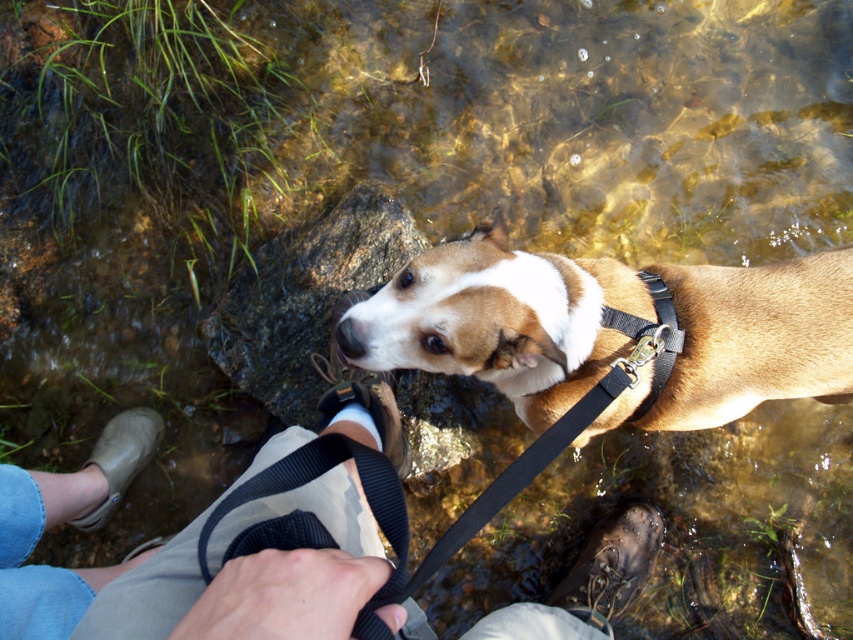
Looking at this image, you are standing behind the brown matte dog at center and want to pick up the brown rough rock at center. Can you reach it without moving your feet?

The brown matte dog at center is closer to you than the brown rough rock at center, so you can reach it without moving your feet.

You are a hiker trying to cross a shallow stream. You have your tan canvas pants at lower center and tan rubber boot at lower left. Which item is higher up on your body?

The tan canvas pants at lower center is much taller than the tan rubber boot at lower left, so the tan canvas pants at lower center is higher up on your body.

You are a photographer trying to capture the perfect shot of the brown matte dog at center. If you want to position the dog exactly at the center of your camera frame, which currently has the dog slightly off to the left, should you move the camera to the left or right?

The brown matte dog at center is already positioned at point 0.516 on the x and 0.717 on the y. To center it, move the camera slightly to the right since the dog is slightly to the left of the true center.